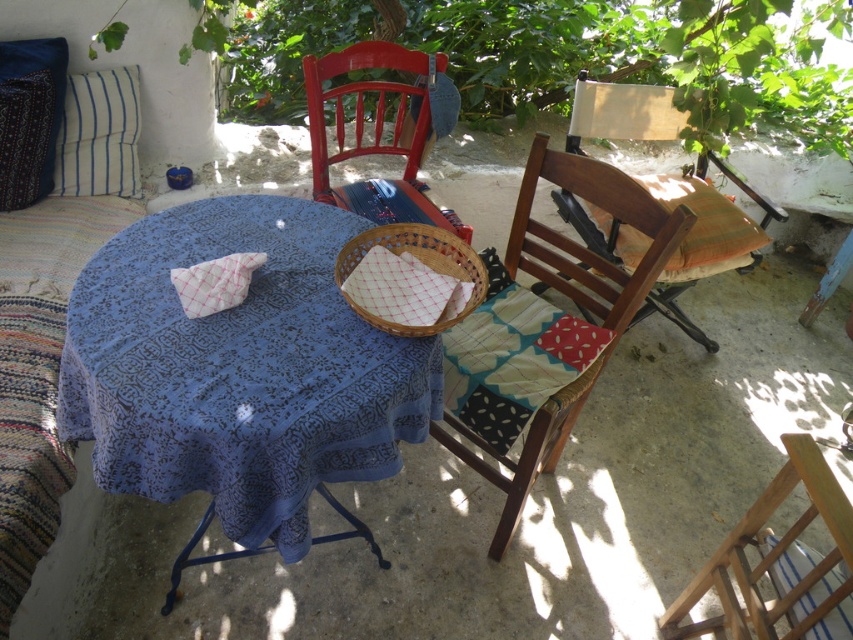
You are standing in the outdoor seating area and want to place a new decorative item on the table. Where should you place it to avoid overlapping with the blue patterned fabric pillow at upper left?

The blue patterned fabric pillow at upper left is located at point (28,116), so place the new decorative item elsewhere on the table to avoid overlapping with it.

You are setting up a picnic and need to place the red checkered cloth at center between the wooden chair at right and another object. Which object is the chair positioned next to?

The wooden chair at right is positioned on the right side of the red checkered cloth at center, so it is next to the red checkered cloth at center.

You are planning to place a decorative vase that is 12 inches wide between the blue patterned fabric pillow at upper left and the white checkered cloth at center. Can the vase fit in the space between them?

The distance between the blue patterned fabric pillow at upper left and the white checkered cloth at center is 38.79 inches. Since the vase is only 12 inches wide, there is sufficient space to place it between them.